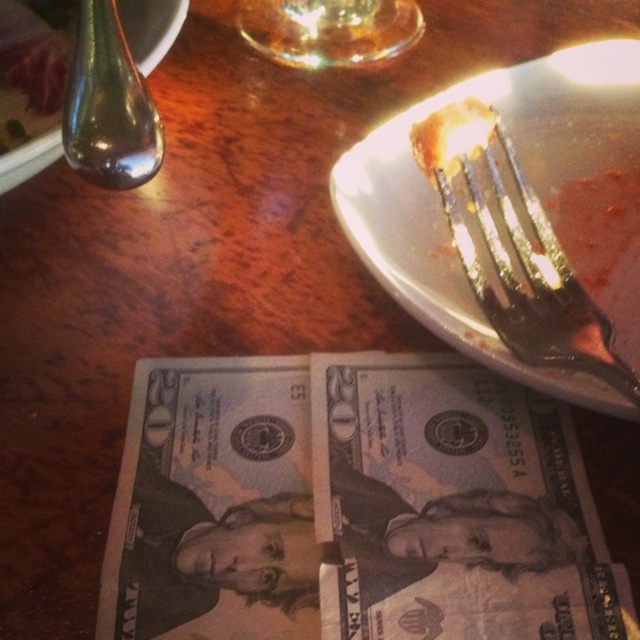
You are a customer at a restaurant and want to reach for the transparent glass at upper center and the metallic spoon at upper left. Which one is closer to you?

The transparent glass at upper center is closer to you than the metallic spoon at upper left because it is further to the viewer.

You are standing at a distance from the table setting. There is a point labeled as point (512, 72) in the image. Can you estimate how far you are from this point?

The distance between point (512, 72) and the viewer is 16.11 inches, so you are 16.11 inches away from this point.

You are a diner at a restaurant and see the metallic silver fork at upper right and the metallic spoon at upper left on your table. Which utensil is closer to your right hand if you are sitting facing the table?

The metallic silver fork at upper right is closer to your right hand because it is positioned to the right of the metallic spoon at upper left.